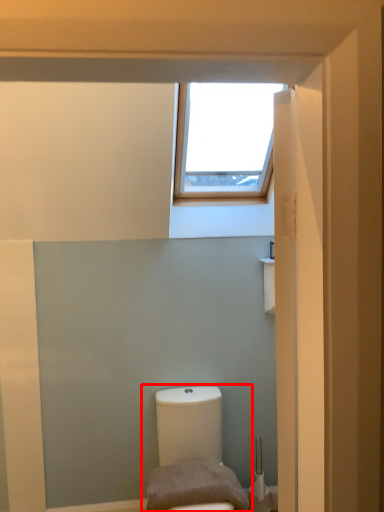
Question: Observing the image, what is the correct spatial positioning of toilet (annotated by the red box) in reference to pillow?

Choices:
 (A) right
 (B) left

Answer: (A)